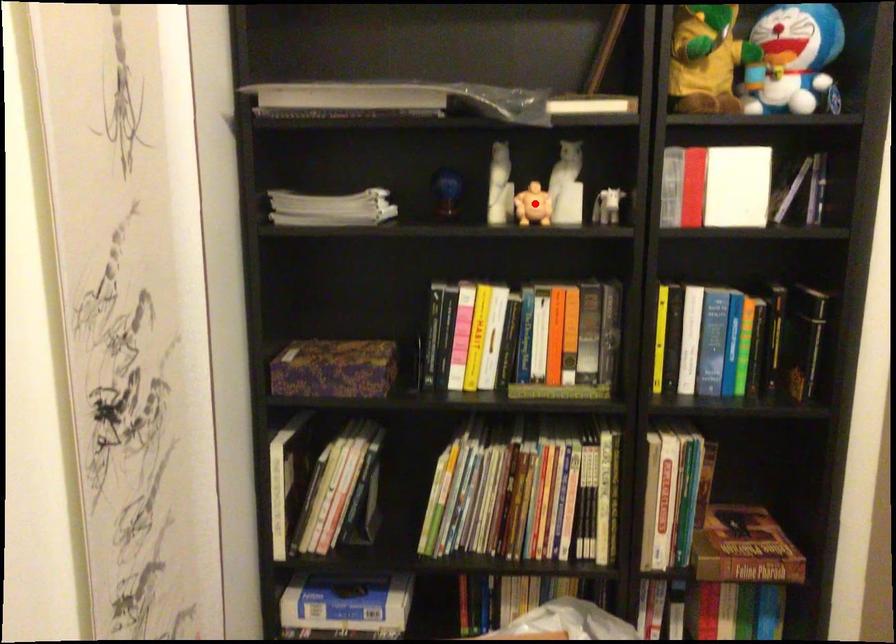
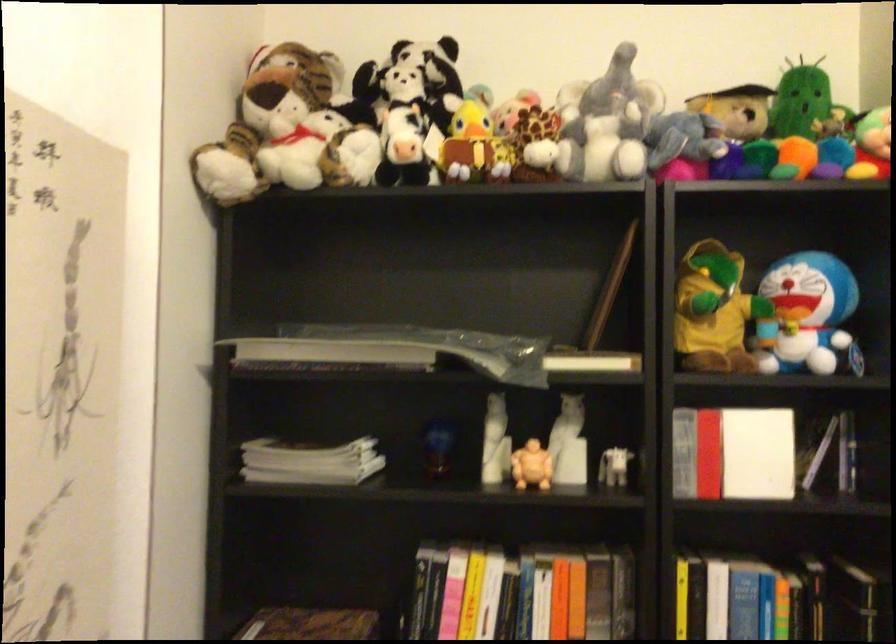
Locate, in the second image, the point that corresponds to the highlighted location in the first image.

(531, 466)